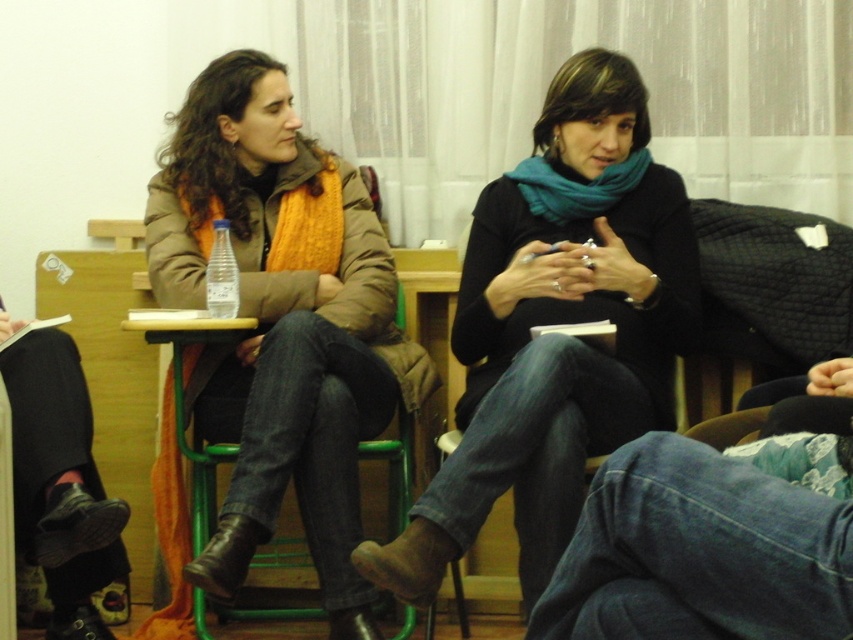
Question: Considering the relative positions of matte black sweater at center and teal soft scarf at center in the image provided, where is matte black sweater at center located with respect to teal soft scarf at center?

Choices:
 (A) left
 (B) right

Answer: (A)

Question: Which point is closer to the camera?

Choices:
 (A) (543, 160)
 (B) (602, 422)
 (C) (160, 168)

Answer: (B)

Question: Is the position of teal soft scarf at center less distant than that of clear plastic bottle at center?

Choices:
 (A) yes
 (B) no

Answer: (B)

Question: Which object appears farthest from the camera in this image?

Choices:
 (A) teal soft scarf at center
 (B) matte black sweater at center
 (C) clear plastic bottle at center
 (D) green metal chair at center

Answer: (A)

Question: Which of the following is the closest to the observer?

Choices:
 (A) (535, 161)
 (B) (206, 429)
 (C) (490, 317)
 (D) (216, 307)

Answer: (D)

Question: Can you confirm if matte black sweater at center is positioned below matte brown jacket at left?

Choices:
 (A) no
 (B) yes

Answer: (A)